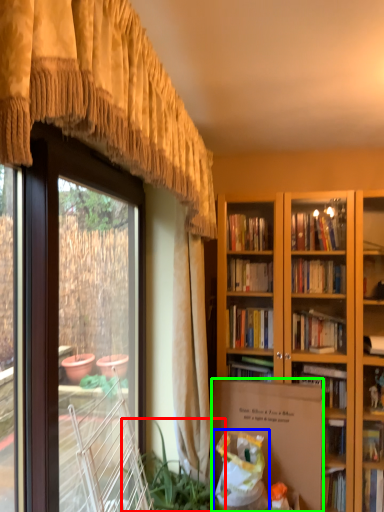
Question: Based on their relative distances, which object is nearer to houseplant (highlighted by a red box)? Choose from shopping bag (highlighted by a blue box) and cardboard box (highlighted by a green box).

Choices:
 (A) shopping bag
 (B) cardboard box

Answer: (A)